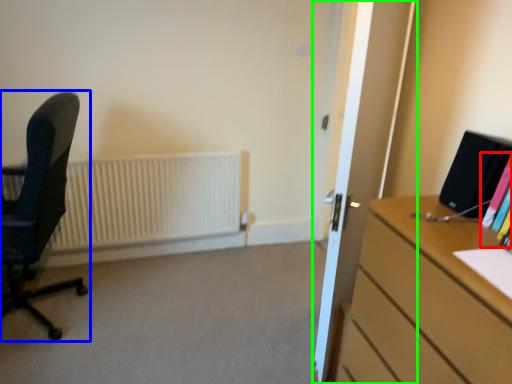
Question: Estimate the real-world distances between objects in this image. Which object is farther from book (highlighted by a red box), chair (highlighted by a blue box) or glass door (highlighted by a green box)?

Choices:
 (A) chair
 (B) glass door

Answer: (A)